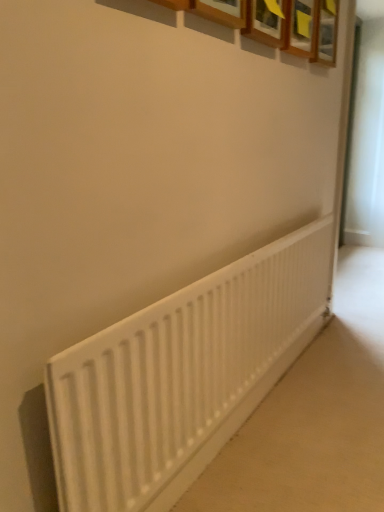
Question: From a real-world perspective, is white matte radiator at lower center physically located above or below wooden frame at upper center, the 1th picture frame in the left-to-right sequence?

Choices:
 (A) above
 (B) below

Answer: (B)

Question: Would you say white matte radiator at lower center is inside or outside wooden frame at upper center, which is counted as the second picture frame, starting from the back?

Choices:
 (A) outside
 (B) inside

Answer: (A)

Question: Which is nearer to the wooden frame at upper center, which is the second picture frame in right-to-left order?

Choices:
 (A) white matte radiator at lower center
 (B) wooden picture frame at upper center, the 2th picture frame when ordered from left to right

Answer: (B)

Question: Which object is the farthest from the wooden frame at upper center, positioned as the 1th picture frame in front-to-back order?

Choices:
 (A) white matte radiator at lower center
 (B) wooden picture frame at upper center, the 2th picture frame when ordered from left to right

Answer: (A)